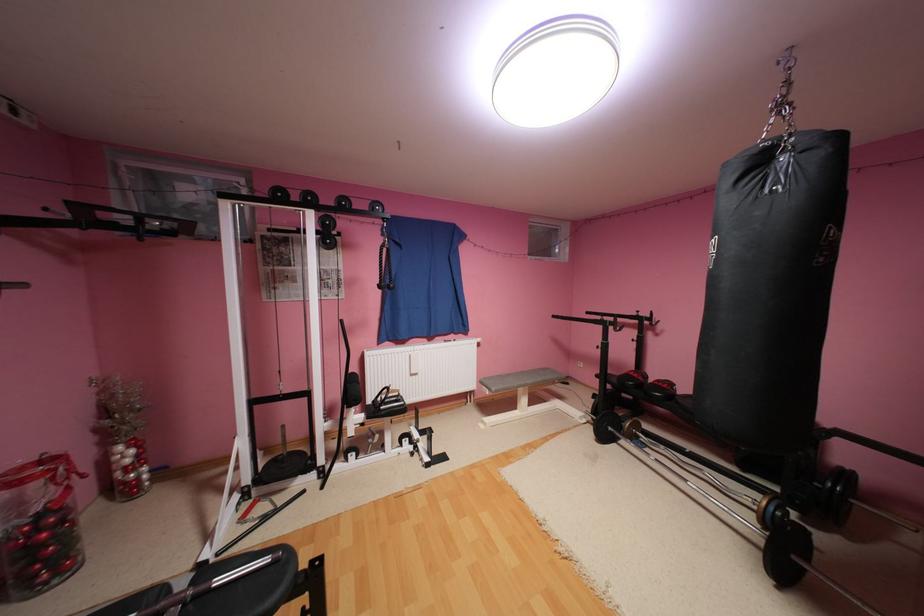
This screenshot has height=616, width=924. Describe the element at coordinates (520, 379) in the screenshot. I see `the bench sitting surface` at that location.